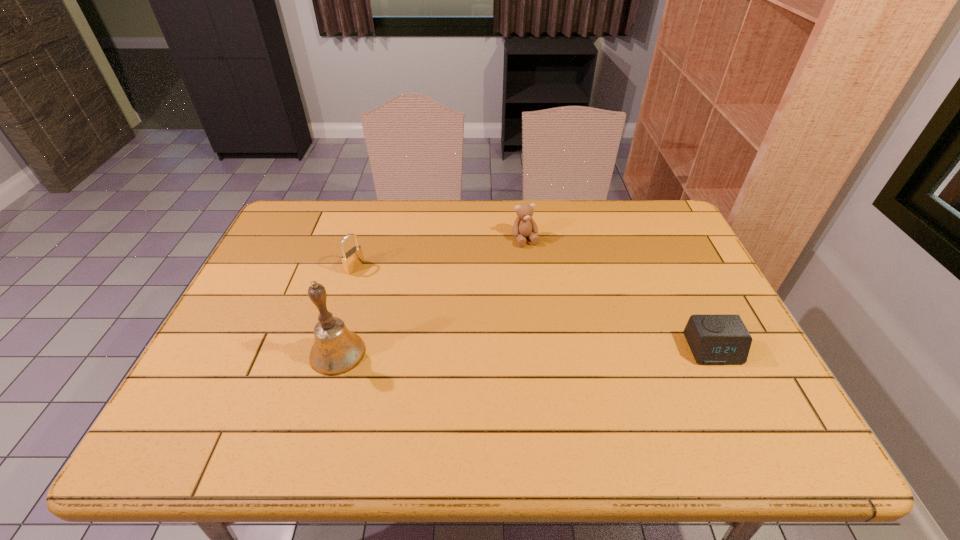
This screenshot has height=540, width=960. I want to click on bell, so click(x=336, y=350).

In order to click on the shortest object in this screenshot , I will do `click(713, 339)`.

At what (x,y) coordinates should I click in order to perform the action: click on alarm clock. Please return your answer as a coordinate pair (x, y). This screenshot has height=540, width=960. Looking at the image, I should click on (713, 339).

Locate an element on the screen. This screenshot has height=540, width=960. the second object from right to left is located at coordinates (524, 226).

This screenshot has width=960, height=540. What are the coordinates of `the farthest object` in the screenshot? It's located at (524, 226).

Locate an element on the screen. the second farthest object is located at coordinates (353, 259).

You are a GUI agent. You are given a task and a screenshot of the screen. Output one action in this format:
    pyautogui.click(x=<x>, y=<y>)
    Task: Click on the free space located on the left of the tallest object
    
    Given the screenshot: What is the action you would take?
    pyautogui.click(x=228, y=353)

You are a GUI agent. You are given a task and a screenshot of the screen. Output one action in this format:
    pyautogui.click(x=<x>, y=<y>)
    Task: Click on the vacant area situated 0.090m on the front-facing side of the alarm clock
    The image size is (960, 540).
    Given the screenshot: What is the action you would take?
    pyautogui.click(x=736, y=399)

Where is `free space located on the face of the teddy bear`? This screenshot has width=960, height=540. free space located on the face of the teddy bear is located at coordinates (543, 275).

Identify the location of vacant region located 0.320m on the face of the teddy bear. The width and height of the screenshot is (960, 540). (567, 323).